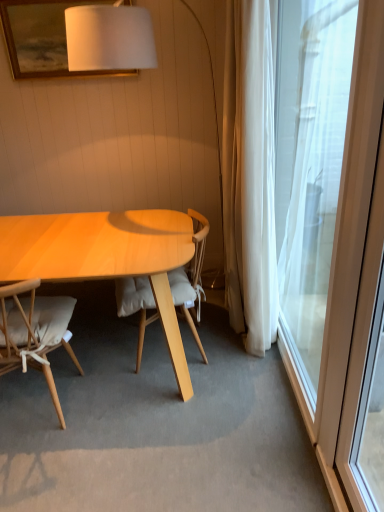
What do you see at coordinates (42, 38) in the screenshot?
I see `white matte picture frame at upper center` at bounding box center [42, 38].

Identify the location of light wood/wooden chair at center, the 2th chair in the left-to-right sequence. (191, 278).

Locate an element on the screen. Image resolution: width=384 pixels, height=512 pixels. white matte picture frame at upper center is located at coordinates (42, 38).

Can you confirm if white matte picture frame at upper center is thinner than light wood/wooden chair at center, the 2th chair in the left-to-right sequence?

Yes, white matte picture frame at upper center is thinner than light wood/wooden chair at center, the 2th chair in the left-to-right sequence.

Does white matte picture frame at upper center appear on the left side of light wood/wooden chair at center, the 1th chair viewed from the right?

Indeed, white matte picture frame at upper center is positioned on the left side of light wood/wooden chair at center, the 1th chair viewed from the right.

Find the location of a particular element. Image resolution: width=384 pixels, height=512 pixels. chair that is on the right side of white matte picture frame at upper center is located at coordinates (191, 278).

Is light brown wood chair at left, which ranks as the second chair in right-to-left order, facing away from light wood/wooden chair at center, the 2th chair in the left-to-right sequence?

No, light brown wood chair at left, which ranks as the second chair in right-to-left order, is not facing the opposite direction of light wood/wooden chair at center, the 2th chair in the left-to-right sequence.

Which is correct: light brown wood chair at left, which ranks as the second chair in right-to-left order, is inside light wood/wooden chair at center, the 1th chair viewed from the right, or outside of it?

light brown wood chair at left, which ranks as the second chair in right-to-left order, is spatially situated outside light wood/wooden chair at center, the 1th chair viewed from the right.

Who is taller, light brown wood chair at left, acting as the first chair starting from the left, or light wood/wooden chair at center, the 1th chair viewed from the right?

light wood/wooden chair at center, the 1th chair viewed from the right, is taller.

Does light brown wood chair at left, acting as the first chair starting from the left, come behind light wood/wooden chair at center, the 2th chair in the left-to-right sequence?

No, light brown wood chair at left, acting as the first chair starting from the left, is closer to the viewer.

Which is closer, (3, 3) or (18, 344)?

Point (3, 3) is positioned farther from the camera compared to point (18, 344).

Is white matte picture frame at upper center situated inside light brown wood chair at left, which ranks as the second chair in right-to-left order, or outside?

white matte picture frame at upper center is not inside light brown wood chair at left, which ranks as the second chair in right-to-left order, it's outside.

Considering the sizes of white matte picture frame at upper center and light brown wood chair at left, which ranks as the second chair in right-to-left order, in the image, is white matte picture frame at upper center bigger or smaller than light brown wood chair at left, which ranks as the second chair in right-to-left order,?

In the image, white matte picture frame at upper center appears to be smaller than light brown wood chair at left, which ranks as the second chair in right-to-left order.

From the image's perspective, who appears lower, white matte picture frame at upper center or light brown wood chair at left, which ranks as the second chair in right-to-left order?

light brown wood chair at left, which ranks as the second chair in right-to-left order.

Considering the relative sizes of light wood/wooden chair at center, the 1th chair viewed from the right, and white matte picture frame at upper center in the image provided, is light wood/wooden chair at center, the 1th chair viewed from the right, bigger than white matte picture frame at upper center?

Correct, light wood/wooden chair at center, the 1th chair viewed from the right, is larger in size than white matte picture frame at upper center.

Is light wood/wooden chair at center, the 1th chair viewed from the right, shorter than white matte picture frame at upper center?

Incorrect, the height of light wood/wooden chair at center, the 1th chair viewed from the right, does not fall short of that of white matte picture frame at upper center.

Could white matte picture frame at upper center be considered to be inside light wood/wooden chair at center, the 1th chair viewed from the right?

No, white matte picture frame at upper center is not inside light wood/wooden chair at center, the 1th chair viewed from the right.

Does transparent glass window at right appear on the right side of light brown wood chair at left, acting as the first chair starting from the left?

Yes.

Would you consider transparent glass window at right to be distant from light brown wood chair at left, which ranks as the second chair in right-to-left order?

That's right, there is a large distance between transparent glass window at right and light brown wood chair at left, which ranks as the second chair in right-to-left order.

Is transparent glass window at right completely or partially outside of light brown wood chair at left, acting as the first chair starting from the left?

Yes.

Is light brown wood chair at left, which ranks as the second chair in right-to-left order, directly adjacent to white matte picture frame at upper center?

There is a gap between light brown wood chair at left, which ranks as the second chair in right-to-left order, and white matte picture frame at upper center.

Is light brown wood chair at left, which ranks as the second chair in right-to-left order, aimed at white matte picture frame at upper center?

No, light brown wood chair at left, which ranks as the second chair in right-to-left order, is not oriented towards white matte picture frame at upper center.

Is light brown wood chair at left, acting as the first chair starting from the left, further to the viewer compared to white matte picture frame at upper center?

No.

Considering the positions of objects transparent glass window at right and light wood/wooden chair at center, the 1th chair viewed from the right, in the image provided, who is in front, transparent glass window at right or light wood/wooden chair at center, the 1th chair viewed from the right,?

transparent glass window at right is in front.

Is transparent glass window at right thinner than light wood/wooden chair at center, the 1th chair viewed from the right?

Yes.

From a real-world perspective, is transparent glass window at right located higher than light wood/wooden chair at center, the 1th chair viewed from the right?

Indeed, from a real-world perspective, transparent glass window at right stands above light wood/wooden chair at center, the 1th chair viewed from the right.

There is a transparent glass window at right. In order to click on the 1st chair below it (from a real-world perspective) in this screenshot , I will do `click(191, 278)`.

You are a GUI agent. You are given a task and a screenshot of the screen. Output one action in this format:
    pyautogui.click(x=<x>, y=<y>)
    Task: Click on the 1st chair in front when counting from the white matte picture frame at upper center
    The image size is (384, 512).
    Given the screenshot: What is the action you would take?
    [x=191, y=278]

You are a GUI agent. You are given a task and a screenshot of the screen. Output one action in this format:
    pyautogui.click(x=<x>, y=<y>)
    Task: Click on the chair above the light brown wood chair at left, which ranks as the second chair in right-to-left order (from a real-world perspective)
    The image size is (384, 512).
    Given the screenshot: What is the action you would take?
    tap(191, 278)

Looking at the image, which one is located closer to light wood/wooden chair at center, the 2th chair in the left-to-right sequence, white matte picture frame at upper center or light brown wood chair at left, acting as the first chair starting from the left?

light brown wood chair at left, acting as the first chair starting from the left.

Considering their positions, is transparent glass window at right positioned further to light brown wood chair at left, acting as the first chair starting from the left, than light wood/wooden chair at center, the 1th chair viewed from the right?

transparent glass window at right lies further to light brown wood chair at left, acting as the first chair starting from the left, than the other object.

Considering their positions, is white matte picture frame at upper center positioned further to light brown wood chair at left, which ranks as the second chair in right-to-left order, than transparent glass window at right?

Based on the image, white matte picture frame at upper center appears to be further to light brown wood chair at left, which ranks as the second chair in right-to-left order.

Looking at the image, which one is located closer to light brown wood chair at left, acting as the first chair starting from the left, light wood/wooden chair at center, the 2th chair in the left-to-right sequence, or white matte picture frame at upper center?

light wood/wooden chair at center, the 2th chair in the left-to-right sequence, lies closer to light brown wood chair at left, acting as the first chair starting from the left, than the other object.

From the image, which object appears to be nearer to transparent glass window at right, light wood/wooden chair at center, the 1th chair viewed from the right, or light brown wood chair at left, acting as the first chair starting from the left?

light wood/wooden chair at center, the 1th chair viewed from the right, lies closer to transparent glass window at right than the other object.

Looking at the image, which one is located closer to white matte picture frame at upper center, light wood/wooden chair at center, the 2th chair in the left-to-right sequence, or light brown wood chair at left, which ranks as the second chair in right-to-left order?

The object closer to white matte picture frame at upper center is light wood/wooden chair at center, the 2th chair in the left-to-right sequence.

Considering their positions, is light brown wood chair at left, which ranks as the second chair in right-to-left order, positioned further to white matte picture frame at upper center than light wood/wooden chair at center, the 2th chair in the left-to-right sequence?

Among the two, light brown wood chair at left, which ranks as the second chair in right-to-left order, is located further to white matte picture frame at upper center.

Considering their positions, is white matte picture frame at upper center positioned further to transparent glass window at right than light wood/wooden chair at center, the 2th chair in the left-to-right sequence?

The object further to transparent glass window at right is white matte picture frame at upper center.

The height and width of the screenshot is (512, 384). In order to click on window that lies between white matte picture frame at upper center and light brown wood chair at left, acting as the first chair starting from the left, from top to bottom in this screenshot , I will do `click(310, 166)`.

What are the coordinates of `chair between white matte picture frame at upper center and light brown wood chair at left, which ranks as the second chair in right-to-left order, from top to bottom` in the screenshot? It's located at (191, 278).

This screenshot has width=384, height=512. Find the location of `window between white matte picture frame at upper center and light wood/wooden chair at center, the 2th chair in the left-to-right sequence, vertically`. window between white matte picture frame at upper center and light wood/wooden chair at center, the 2th chair in the left-to-right sequence, vertically is located at coordinates (310, 166).

Locate an element on the screen. The width and height of the screenshot is (384, 512). chair between light brown wood chair at left, acting as the first chair starting from the left, and transparent glass window at right, in the horizontal direction is located at coordinates (191, 278).